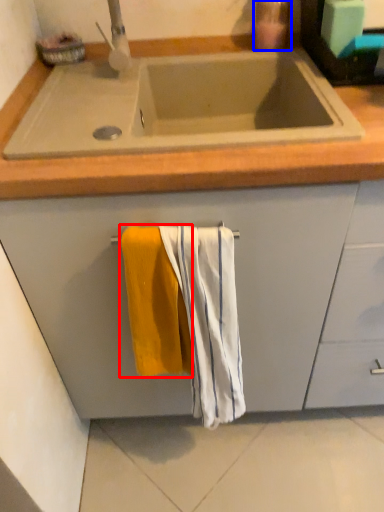
Question: Among these objects, which one is farthest to the camera, beach towel (highlighted by a red box) or soap dispenser (highlighted by a blue box)?

Choices:
 (A) beach towel
 (B) soap dispenser

Answer: (B)